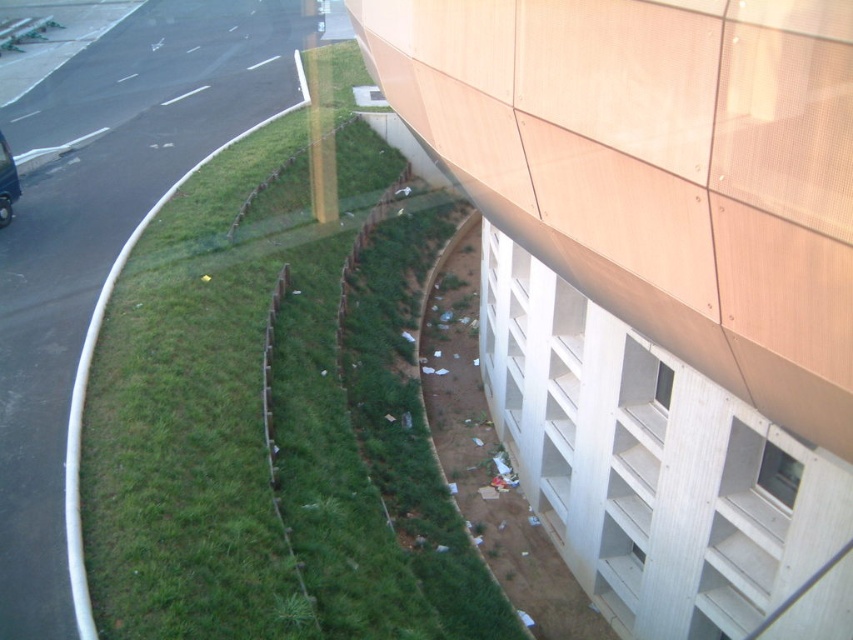
Is green grass at lower left positioned before shiny black car at left?

That is True.

Is point (207, 460) less distant than point (0, 220)?

Yes.

Is point (146, 340) more distant than point (9, 193)?

No, (146, 340) is in front of (9, 193).

Locate an element on the screen. This screenshot has width=853, height=640. green grass at lower left is located at coordinates (268, 416).